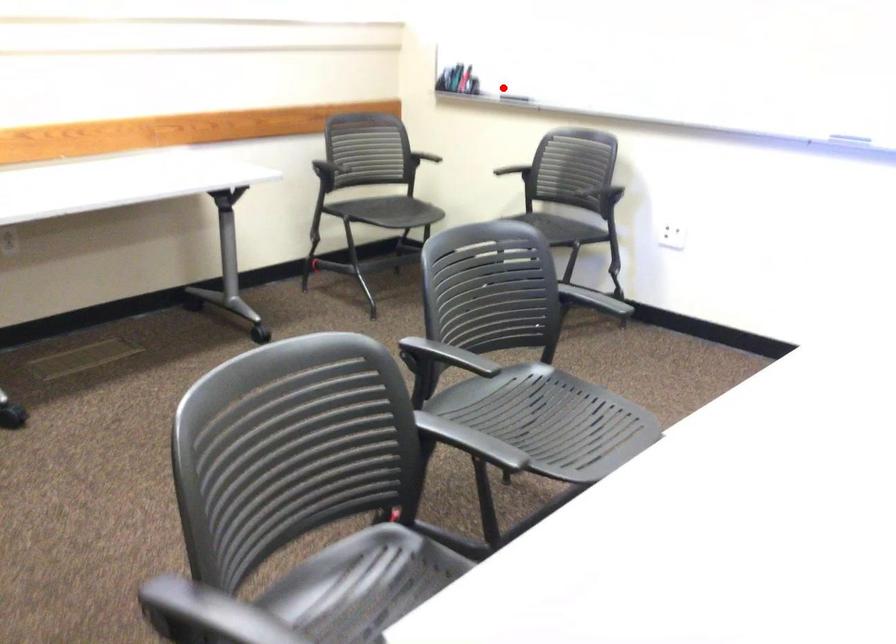
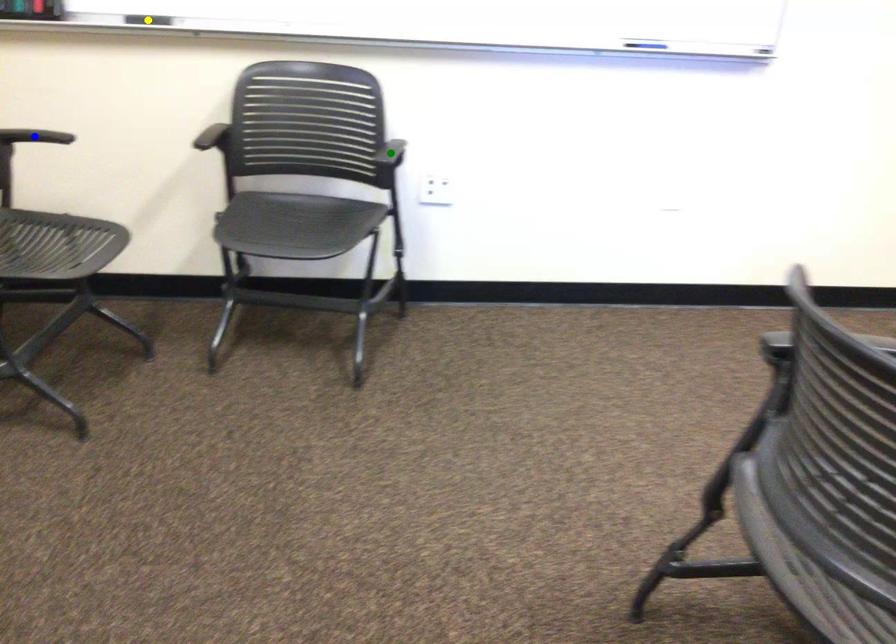
Question: I am providing you with two images of the same scene from different viewpoints. A red point is marked on the first image. You are given multiple points on the second image. Can you choose the point in image 2 that corresponds to the point in image 1?

Choices:
 (A) blue point
 (B) yellow point
 (C) green point

Answer: (B)